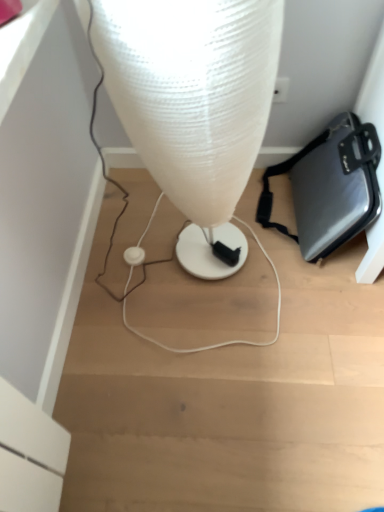
The width and height of the screenshot is (384, 512). What are the coordinates of `vacant space to the left of white plastic earphone at center` in the screenshot? It's located at (100, 261).